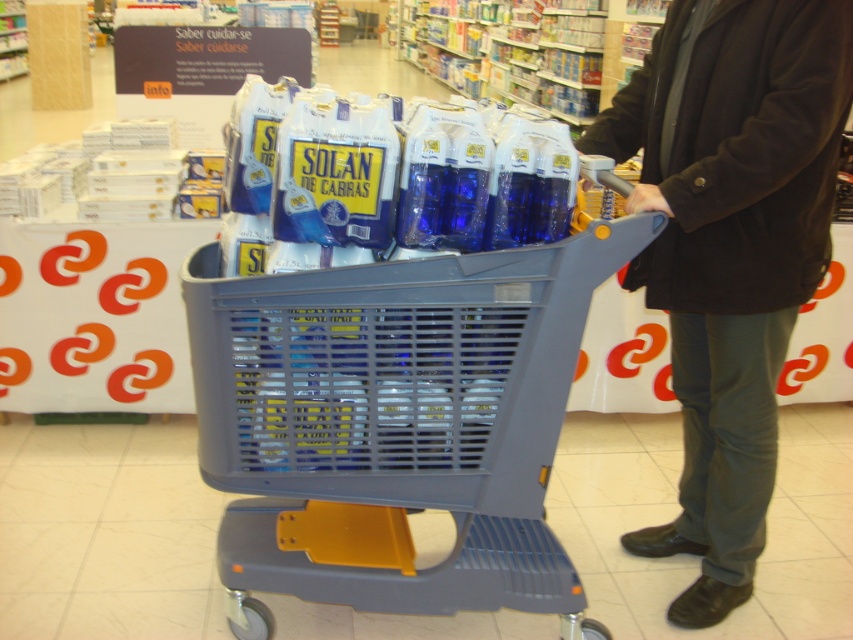
You are a customer in a store holding a dark brown wool coat at center and want to place it into the gray plastic trolley at center. Can you reach the trolley without moving your position?

The gray plastic trolley at center is 22.34 inches away from the dark brown wool coat at center. Since the distance is relatively short, you can likely reach the trolley without moving your position to place the coat inside.

In the scene shown: You are a customer in a supermarket. You see a gray plastic trolley at center and a dark brown wool coat at center. Which item is placed lower in the image?

The gray plastic trolley at center is located below the dark brown wool coat at center, so the gray plastic trolley at center is placed lower in the image.

You are a customer in a supermarket. You see a gray plastic trolley at center and a dark brown wool coat at center. Which item is taller?

The dark brown wool coat at center is taller than the gray plastic trolley at center.